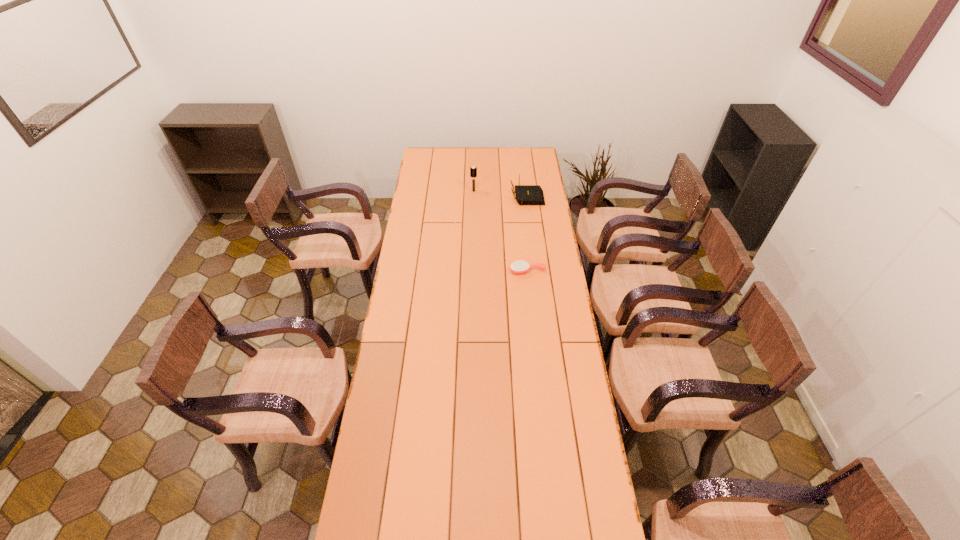
Where is `the left hairbrush`? the left hairbrush is located at coordinates (473, 170).

Locate an element on the screen. The height and width of the screenshot is (540, 960). the farther hairbrush is located at coordinates (473, 170).

You are a GUI agent. You are given a task and a screenshot of the screen. Output one action in this format:
    pyautogui.click(x=<x>, y=<y>)
    Task: Click on the second shortest object
    
    Given the screenshot: What is the action you would take?
    pyautogui.click(x=525, y=194)

In order to click on the right hairbrush in this screenshot , I will do `click(518, 267)`.

Locate an element on the screen. the nearer hairbrush is located at coordinates (518, 267).

Identify the location of free space located 0.230m on the back of the left hairbrush. (474, 167).

The height and width of the screenshot is (540, 960). I want to click on free point located on the left of the second tallest object, so click(x=481, y=197).

Image resolution: width=960 pixels, height=540 pixels. I want to click on blank area located on the left of the shortest object, so click(x=428, y=271).

Where is `router that is positioned at the right edge`? router that is positioned at the right edge is located at coordinates click(x=525, y=194).

Identify the location of hairbrush positioned at the right edge. This screenshot has height=540, width=960. (518, 267).